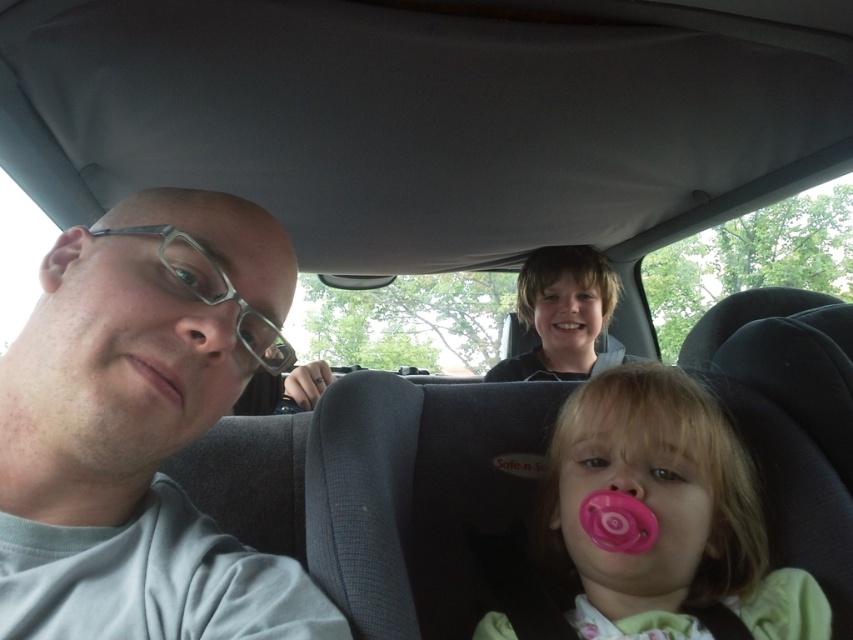
Question: Among these objects, which one is farthest from the camera?

Choices:
 (A) pink matte lips at lower left
 (B) gray matte glasses at left
 (C) pink rubber pacifier at center
 (D) pink rubber pacifier at lower center

Answer: (C)

Question: Is pink rubber pacifier at lower center below smooth skin nose at center?

Choices:
 (A) no
 (B) yes

Answer: (B)

Question: Which point appears closest to the camera in this image?

Choices:
 (A) (547, 289)
 (B) (44, 371)
 (C) (579, 298)

Answer: (B)

Question: Can you confirm if gray matte glasses at left is positioned to the left of smooth black hoodie at upper center?

Choices:
 (A) yes
 (B) no

Answer: (A)

Question: Based on their relative distances, which object is nearer to the matte glass nose at center?

Choices:
 (A) pink matte lips at lower left
 (B) pink glossy teeth at center
 (C) pink rubber pacifier at center

Answer: (A)

Question: Can you confirm if smooth black hoodie at upper center is positioned below smooth skin nose at center?

Choices:
 (A) yes
 (B) no

Answer: (A)